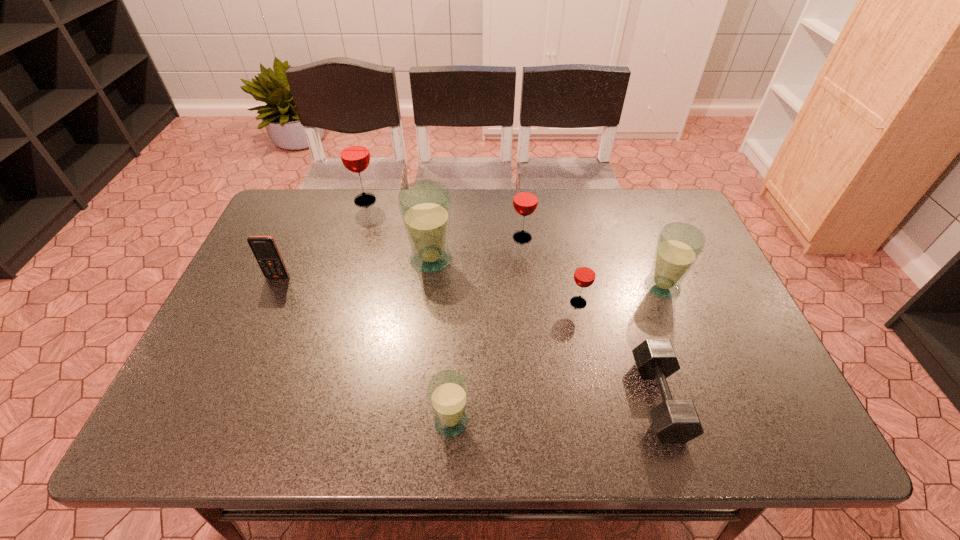
The image size is (960, 540). I want to click on the leftmost glass, so click(x=354, y=152).

This screenshot has height=540, width=960. In order to click on the farthest object in this screenshot , I will do `click(354, 152)`.

I want to click on the biggest blue glass, so click(425, 205).

In order to click on the rightmost blue glass in this screenshot , I will do `click(679, 245)`.

Image resolution: width=960 pixels, height=540 pixels. Find the location of `the second biggest blue glass`. the second biggest blue glass is located at coordinates (679, 245).

Find the location of a particular element. the second biggest red glass is located at coordinates (525, 200).

I want to click on the second red glass from left to right, so click(525, 200).

At what (x,y) coordinates should I click in order to perform the action: click on the leftmost object. Please return your answer as a coordinate pair (x, y). Image resolution: width=960 pixels, height=540 pixels. Looking at the image, I should click on (264, 248).

In order to click on cellular telephone in this screenshot , I will do `click(264, 248)`.

Where is `the smallest red glass`? This screenshot has width=960, height=540. the smallest red glass is located at coordinates (584, 276).